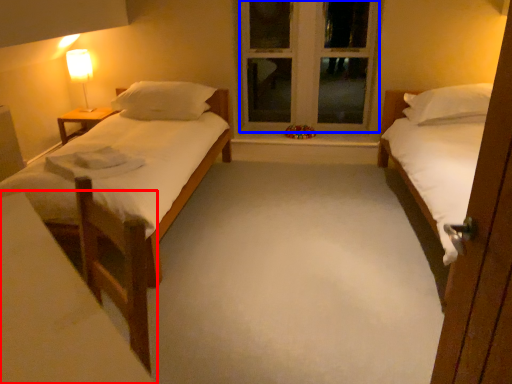
Question: Among these objects, which one is farthest to the camera, vanity (highlighted by a red box) or window frame (highlighted by a blue box)?

Choices:
 (A) vanity
 (B) window frame

Answer: (B)